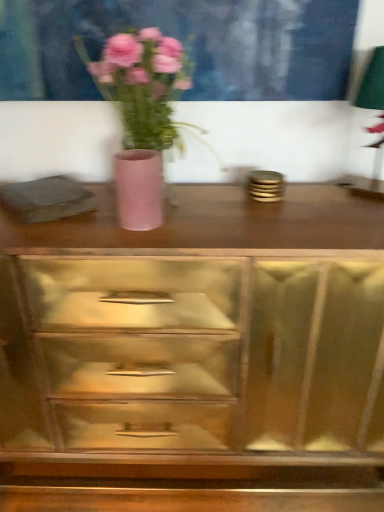
Locate an element on the screen. The image size is (384, 512). free space in front of matte pink vase at center is located at coordinates (131, 247).